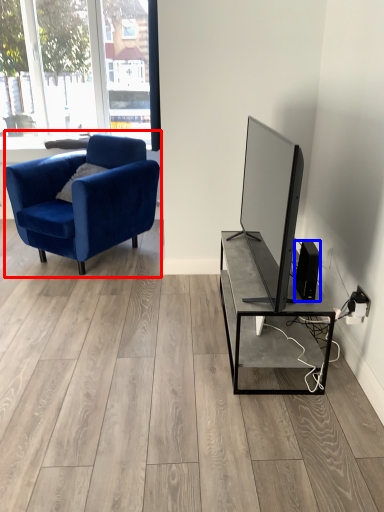
Question: Which of the following is the closest to the observer, chair (highlighted by a red box) or speaker (highlighted by a blue box)?

Choices:
 (A) chair
 (B) speaker

Answer: (B)